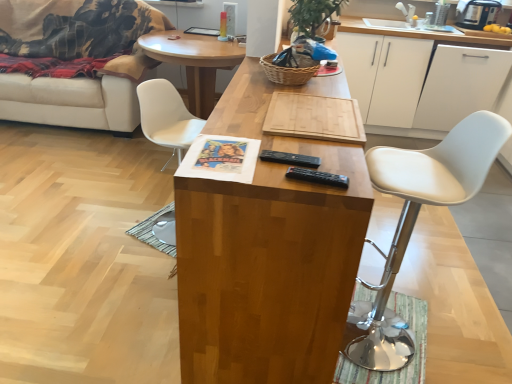
Question: From the image's perspective, is white plastic chair at center, marked as the first chair in a back-to-front arrangement, above white fabric couch at left?

Choices:
 (A) no
 (B) yes

Answer: (A)

Question: Is the position of white plastic chair at center, which appears as the 2th chair when viewed from the front, more distant than that of white fabric couch at left?

Choices:
 (A) no
 (B) yes

Answer: (A)

Question: Considering the relative positions of white plastic chair at center, marked as the first chair in a back-to-front arrangement, and white fabric couch at left in the image provided, is white plastic chair at center, marked as the first chair in a back-to-front arrangement, to the left of white fabric couch at left from the viewer's perspective?

Choices:
 (A) no
 (B) yes

Answer: (A)

Question: From a real-world perspective, is white plastic chair at center, which ranks as the first chair in left-to-right order, under white fabric couch at left?

Choices:
 (A) yes
 (B) no

Answer: (A)

Question: Is white plastic chair at center, marked as the first chair in a back-to-front arrangement, with white fabric couch at left?

Choices:
 (A) yes
 (B) no

Answer: (B)

Question: Are white plastic chair at center, which ranks as the first chair in left-to-right order, and white fabric couch at left far apart?

Choices:
 (A) yes
 (B) no

Answer: (A)

Question: From the image's perspective, would you say woven brown basket at center is positioned over wooden cutting board at center, positioned as the second coffee table in back-to-front order?

Choices:
 (A) yes
 (B) no

Answer: (A)

Question: Is the depth of woven brown basket at center less than that of wooden cutting board at center, which is the 1th coffee table in front-to-back order?

Choices:
 (A) yes
 (B) no

Answer: (B)

Question: Would you say wooden cutting board at center, positioned as the second coffee table in back-to-front order, is part of woven brown basket at center's contents?

Choices:
 (A) no
 (B) yes

Answer: (A)

Question: Does woven brown basket at center turn towards wooden cutting board at center, positioned as the second coffee table in back-to-front order?

Choices:
 (A) yes
 (B) no

Answer: (B)

Question: Considering the relative sizes of woven brown basket at center and wooden cutting board at center, which is the 1th coffee table in front-to-back order, in the image provided, is woven brown basket at center shorter than wooden cutting board at center, which is the 1th coffee table in front-to-back order,?

Choices:
 (A) no
 (B) yes

Answer: (B)

Question: Is woven brown basket at center in contact with wooden cutting board at center, which is the 1th coffee table in front-to-back order?

Choices:
 (A) yes
 (B) no

Answer: (B)

Question: Is wooden cutting board at center, which is the 1th coffee table in front-to-back order, smaller than woven brown basket at center?

Choices:
 (A) yes
 (B) no

Answer: (B)